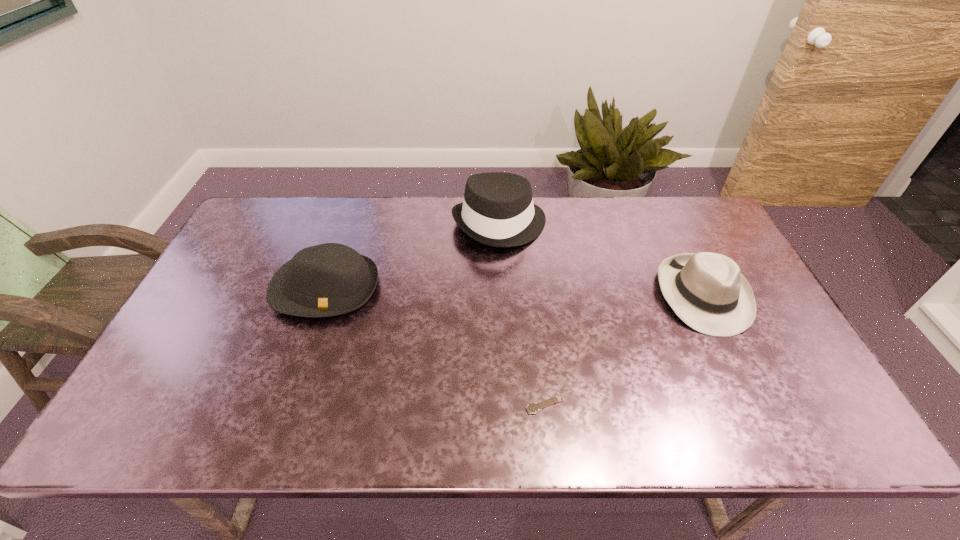
This screenshot has height=540, width=960. I want to click on the tallest object, so click(497, 210).

Find the location of a particular element. The width and height of the screenshot is (960, 540). the farthest object is located at coordinates (497, 210).

Where is `the leftmost fedora`? This screenshot has height=540, width=960. the leftmost fedora is located at coordinates (330, 279).

Where is `the rightmost fedora`? the rightmost fedora is located at coordinates (707, 291).

At what (x,y) coordinates should I click in order to perform the action: click on the nearest object. Please return your answer as a coordinate pair (x, y). Looking at the image, I should click on pos(532,408).

The height and width of the screenshot is (540, 960). What are the coordinates of `the shortest object` in the screenshot? It's located at (532, 408).

Find the location of a particular element. This screenshot has width=960, height=540. free space located on the front of the tallest fedora is located at coordinates (502, 269).

Find the location of a particular element. vacant space located on the front-facing side of the leftmost object is located at coordinates (291, 390).

Where is `vacant space positioned 0.130m on the front-facing side of the rightmost fedora`? This screenshot has width=960, height=540. vacant space positioned 0.130m on the front-facing side of the rightmost fedora is located at coordinates (745, 381).

Where is `free point located on the right of the nearest object`? The image size is (960, 540). free point located on the right of the nearest object is located at coordinates (735, 404).